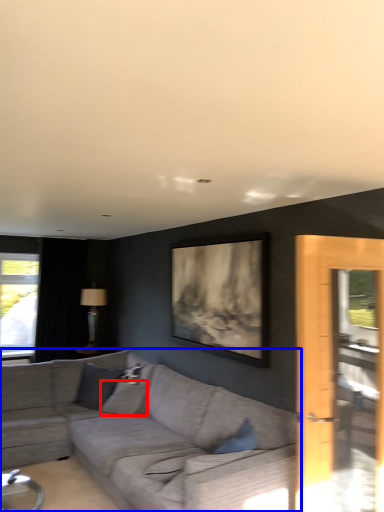
Question: Which of the following is the farthest to the observer, pillow (highlighted by a red box) or studio couch (highlighted by a blue box)?

Choices:
 (A) pillow
 (B) studio couch

Answer: (A)